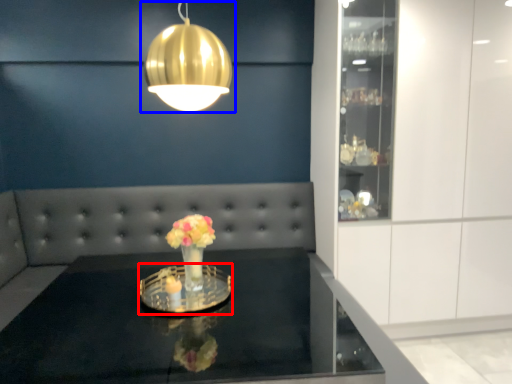
Question: Among these objects, which one is nearest to the camera, glass plate (highlighted by a red box) or lamp (highlighted by a blue box)?

Choices:
 (A) glass plate
 (B) lamp

Answer: (B)